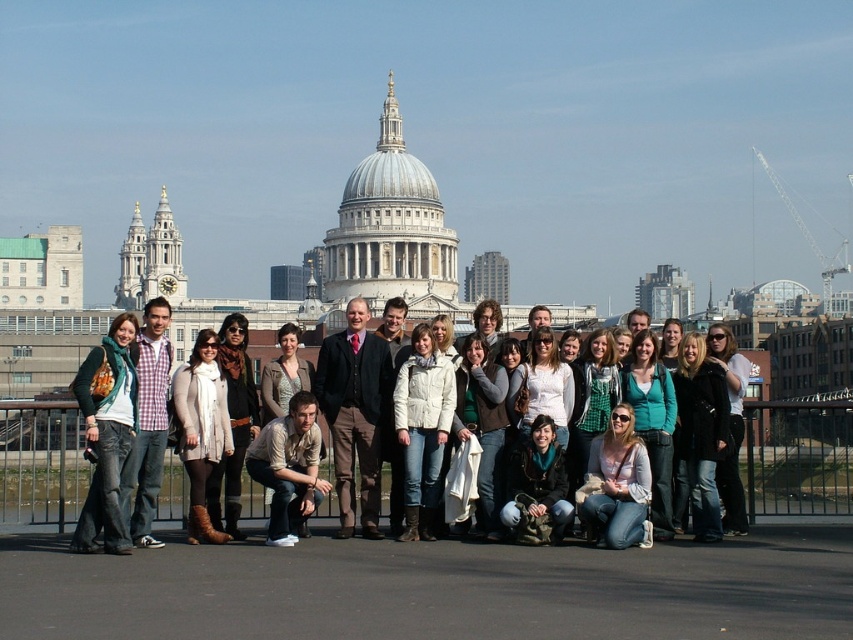
Between denim jacket at left and checkered fabric shirt at left, which one is positioned higher?

Positioned higher is checkered fabric shirt at left.

In the scene shown: Who is positioned more to the left, denim jacket at left or checkered fabric shirt at left?

denim jacket at left is more to the left.

This screenshot has width=853, height=640. Describe the element at coordinates (107, 436) in the screenshot. I see `denim jacket at left` at that location.

Find the location of `denim jacket at left`. denim jacket at left is located at coordinates (107, 436).

Who is positioned more to the left, denim jacket at left or khaki cotton shirt at center?

denim jacket at left is more to the left.

Image resolution: width=853 pixels, height=640 pixels. Identify the location of denim jacket at left. (107, 436).

Locate an element on the screen. denim jacket at left is located at coordinates (107, 436).

Which is in front, point (297, 540) or point (137, 545)?

Point (137, 545)

Does khaki cotton shirt at center appear on the left side of checkered fabric shirt at left?

No, khaki cotton shirt at center is not to the left of checkered fabric shirt at left.

Does point (258, 467) come farther from viewer compared to point (149, 483)?

Yes.

Identify the location of khaki cotton shirt at center. (288, 467).